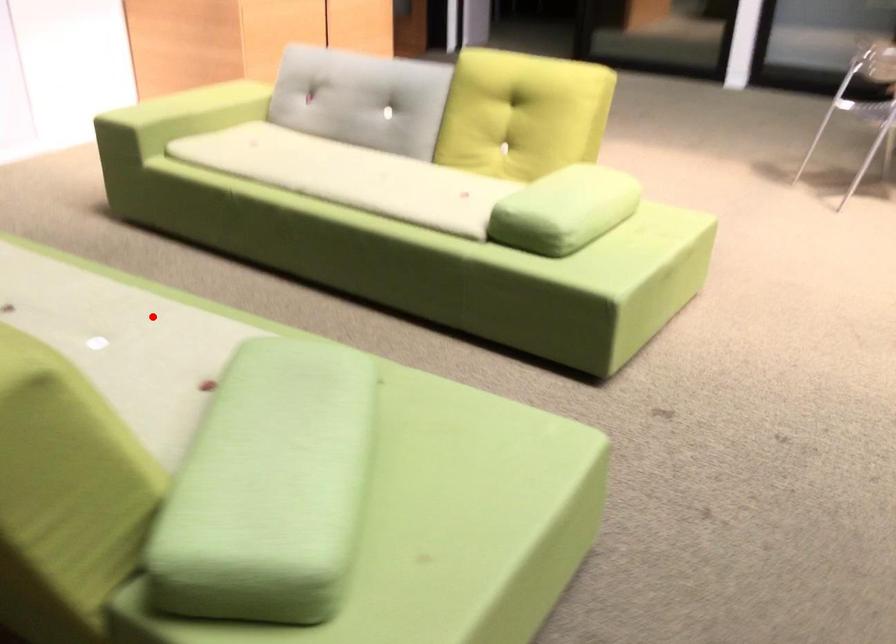
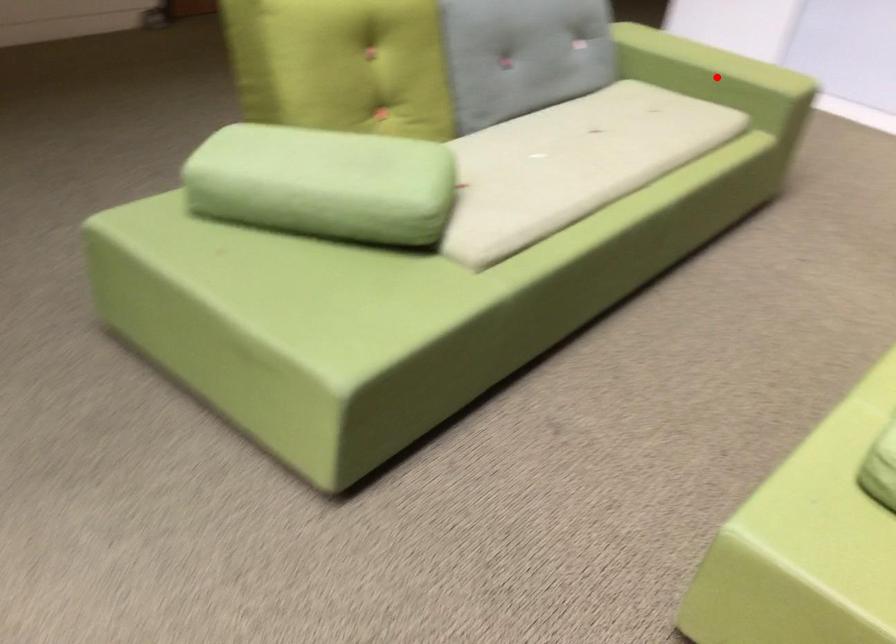
I am providing you with two images of the same scene from different viewpoints. A red point is marked on the first image and another point is marked on the second image. Do the highlighted points in image1 and image2 indicate the same real-world spot?

No